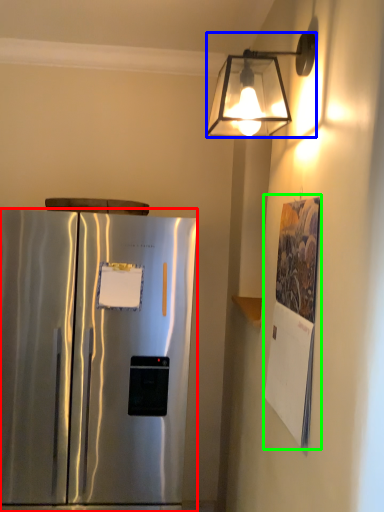
Question: Which object is the farthest from refrigerator (highlighted by a red box)? Choose among these: lamp (highlighted by a blue box) or poster (highlighted by a green box).

Choices:
 (A) lamp
 (B) poster

Answer: (A)